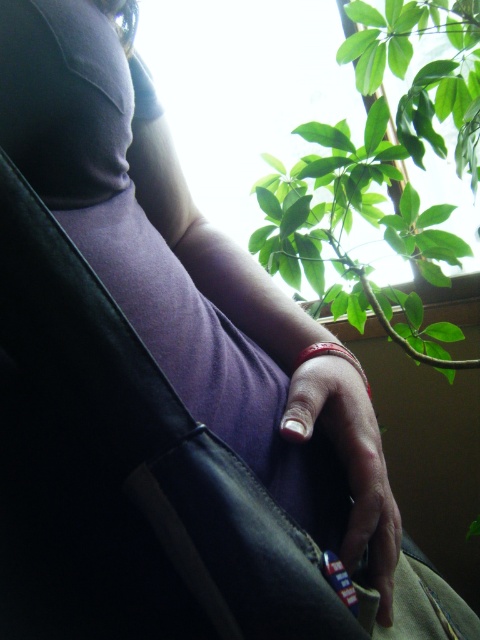
Question: Does white matte nail at center have a smaller size compared to red leather bracelet at center?

Choices:
 (A) yes
 (B) no

Answer: (B)

Question: Which point appears closest to the camera in this image?

Choices:
 (A) (372, 481)
 (B) (434, 216)

Answer: (A)

Question: Which of the following is the closest to the observer?

Choices:
 (A) (289, 387)
 (B) (343, 355)

Answer: (A)

Question: Does white matte nail at center lie in front of red leather bracelet at center?

Choices:
 (A) yes
 (B) no

Answer: (A)

Question: Does white matte nail at center appear over red leather bracelet at center?

Choices:
 (A) no
 (B) yes

Answer: (A)

Question: Based on their relative distances, which object is farther from the red leather bracelet at center?

Choices:
 (A) green leafy plant at upper right
 (B) white matte nail at center

Answer: (A)